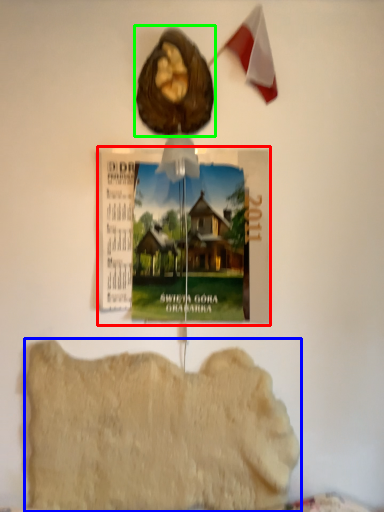
Question: Which is farther away from postcard (highlighted by a red box)? food (highlighted by a blue box) or animal (highlighted by a green box)?

Choices:
 (A) food
 (B) animal

Answer: (A)